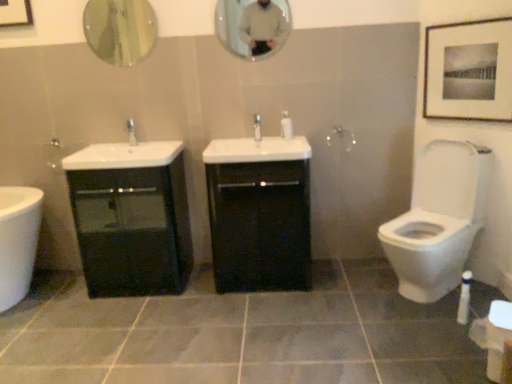
Question: From a real-world perspective, is black glossy cabinet at left, which appears as the second bathroom cabinet when viewed from the right, positioned over matte black picture frame at upper right based on gravity?

Choices:
 (A) no
 (B) yes

Answer: (A)

Question: Is black glossy cabinet at left, which is counted as the 1th bathroom cabinet, starting from the left, to the left of matte black picture frame at upper right from the viewer's perspective?

Choices:
 (A) no
 (B) yes

Answer: (B)

Question: Is the position of black glossy cabinet at left, which is counted as the 1th bathroom cabinet, starting from the left, less distant than that of matte black picture frame at upper right?

Choices:
 (A) yes
 (B) no

Answer: (B)

Question: Is black glossy cabinet at left, which appears as the second bathroom cabinet when viewed from the right, beside matte black picture frame at upper right?

Choices:
 (A) yes
 (B) no

Answer: (B)

Question: Is black glossy cabinet at left, which appears as the second bathroom cabinet when viewed from the right, not near matte black picture frame at upper right?

Choices:
 (A) yes
 (B) no

Answer: (A)

Question: Is black glossy cabinet at left, which appears as the second bathroom cabinet when viewed from the right, not within matte black picture frame at upper right?

Choices:
 (A) no
 (B) yes

Answer: (B)

Question: Are black glossy cabinet at center, the first bathroom cabinet when ordered from right to left, and matte black picture frame at upper right beside each other?

Choices:
 (A) yes
 (B) no

Answer: (B)

Question: Is black glossy cabinet at center, the first bathroom cabinet when ordered from right to left, further to camera compared to matte black picture frame at upper right?

Choices:
 (A) yes
 (B) no

Answer: (A)

Question: Is the position of black glossy cabinet at center, which is counted as the 2th bathroom cabinet, starting from the left, less distant than that of matte black picture frame at upper right?

Choices:
 (A) yes
 (B) no

Answer: (B)

Question: Does black glossy cabinet at center, the first bathroom cabinet when ordered from right to left, have a lesser height compared to matte black picture frame at upper right?

Choices:
 (A) no
 (B) yes

Answer: (A)

Question: From a real-world perspective, does black glossy cabinet at center, the first bathroom cabinet when ordered from right to left, sit lower than matte black picture frame at upper right?

Choices:
 (A) no
 (B) yes

Answer: (B)

Question: Is black glossy cabinet at center, which is counted as the 2th bathroom cabinet, starting from the left, smaller than matte black picture frame at upper right?

Choices:
 (A) yes
 (B) no

Answer: (B)

Question: Is the surface of white glossy soap dispenser at center in direct contact with matte silver faucet at center, the first tap when ordered from left to right?

Choices:
 (A) no
 (B) yes

Answer: (A)